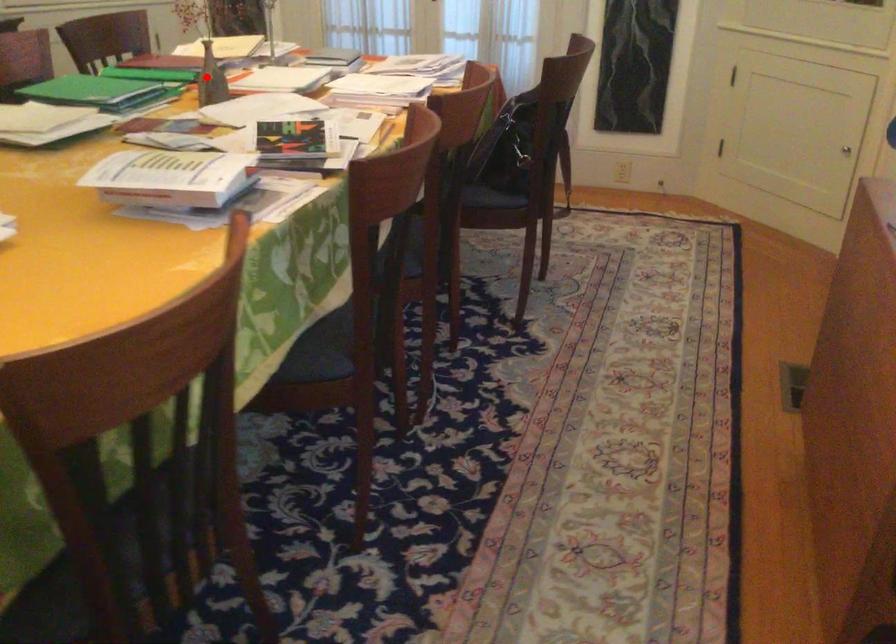
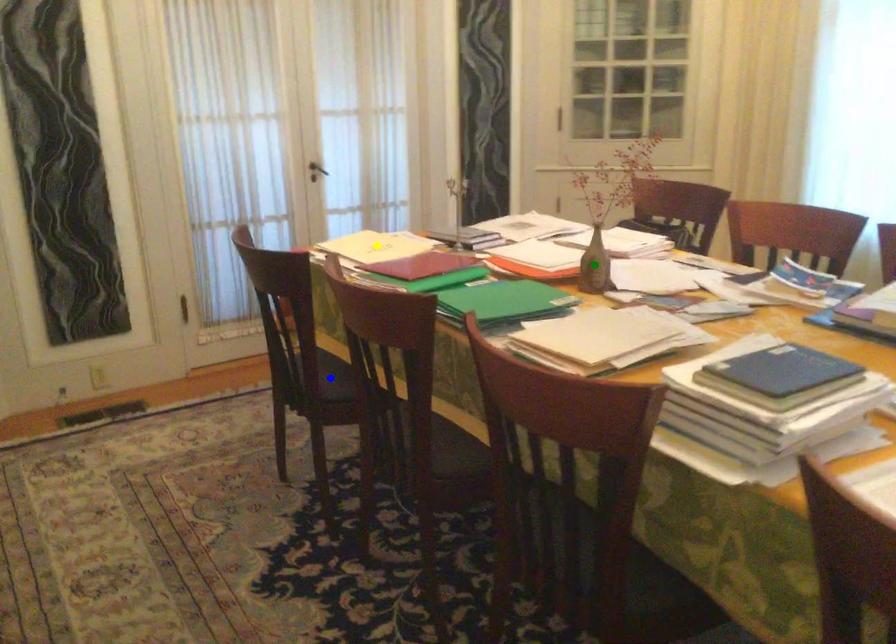
Question: I am providing you with two images of the same scene from different viewpoints. A red point is marked on the first image. You are given multiple points on the second image. Which point in image 2 represents the same 3d spot as the red point in image 1?

Choices:
 (A) green point
 (B) blue point
 (C) yellow point

Answer: (A)